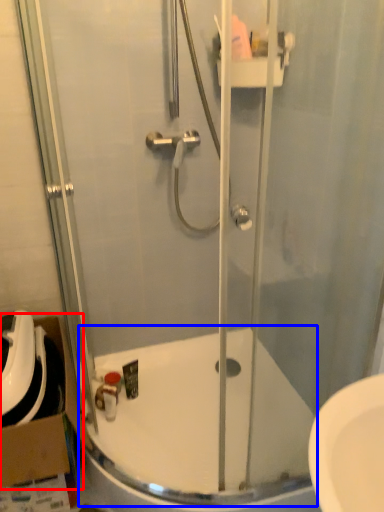
Question: Which point is further to the camera, cardboard box (highlighted by a red box) or bath (highlighted by a blue box)?

Choices:
 (A) cardboard box
 (B) bath

Answer: (A)